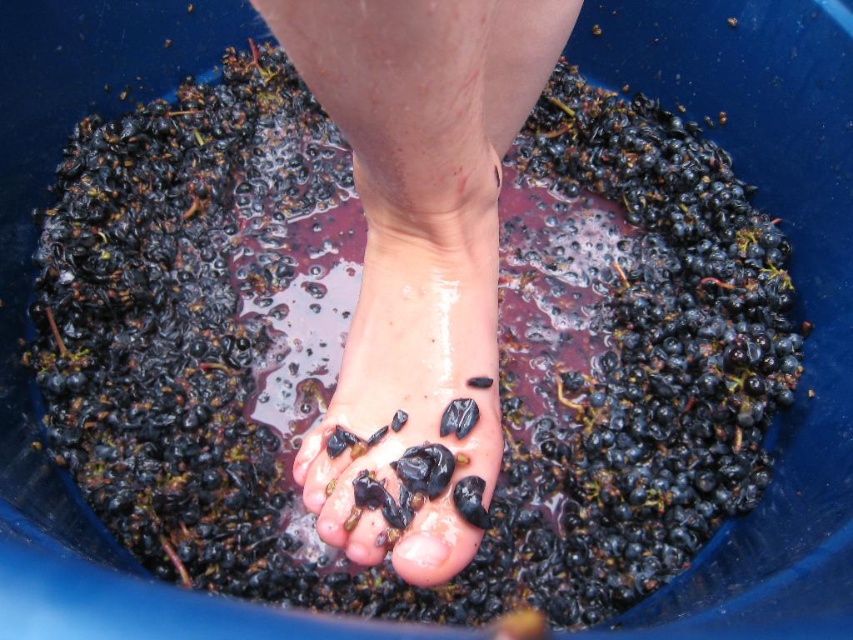
Looking at this image, you are a photographer trying to capture a detailed shot of the glossy black toe at center. Since the wet skin foot at center is blocking the view, can you move the foot to get a better angle?

The wet skin foot at center is closer to the viewer than the glossy black toe at center, so moving the foot would allow the glossy black toe at center to be seen more clearly.

You are a photographer trying to capture a detailed shot of the glossy black toe at center and the wet dark grapes at center. Which object should you focus on first to ensure proper depth of field?

You should focus on the glossy black toe at center first because it is closer to the viewer than the wet dark grapes at center, allowing for better depth of field adjustment.